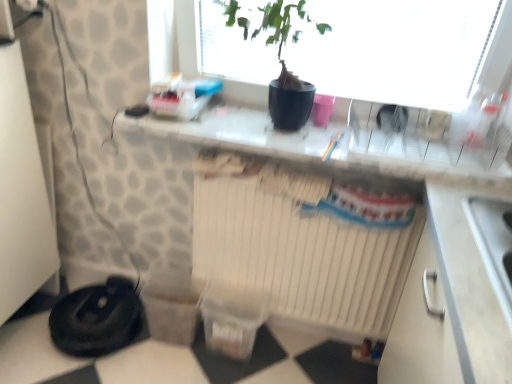
Find the location of a particular element. Image resolution: width=512 pixels, height=384 pixels. free space in front of black rubber vacuum cleaner at lower left is located at coordinates (70, 367).